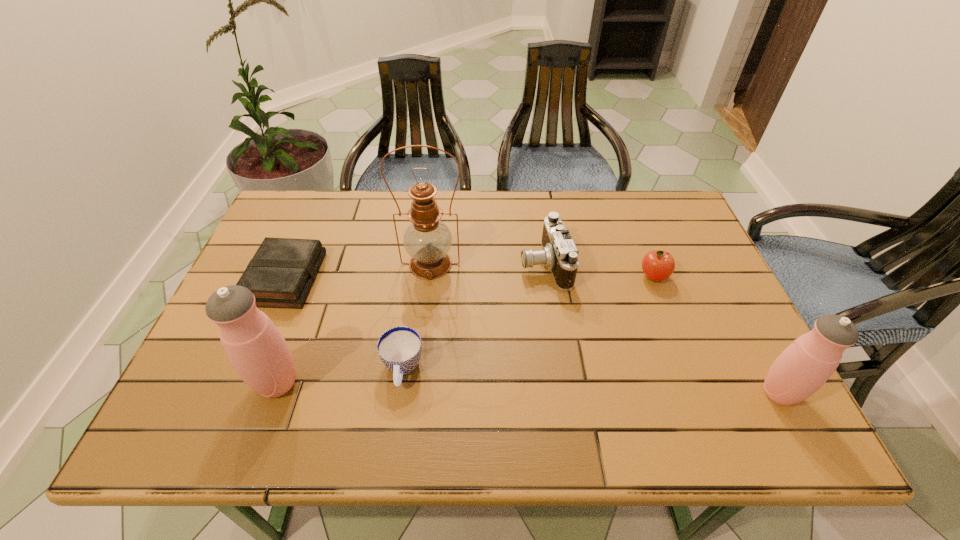
I want to click on the left thermos bottle, so tap(256, 349).

Where is `the second tallest object`? The height and width of the screenshot is (540, 960). the second tallest object is located at coordinates (256, 349).

Where is `the rightmost object`? the rightmost object is located at coordinates (807, 363).

Find the location of `the third tallest object`. the third tallest object is located at coordinates (807, 363).

Image resolution: width=960 pixels, height=540 pixels. I want to click on the tallest object, so click(427, 240).

Identify the location of apple. (658, 265).

This screenshot has height=540, width=960. I want to click on the third object from right to left, so click(559, 253).

The image size is (960, 540). In order to click on book in this screenshot , I will do `click(280, 275)`.

I want to click on the sixth tallest object, so click(x=399, y=348).

Locate an element on the screen. This screenshot has height=540, width=960. vacant space located on the right of the taller thermos bottle is located at coordinates (468, 383).